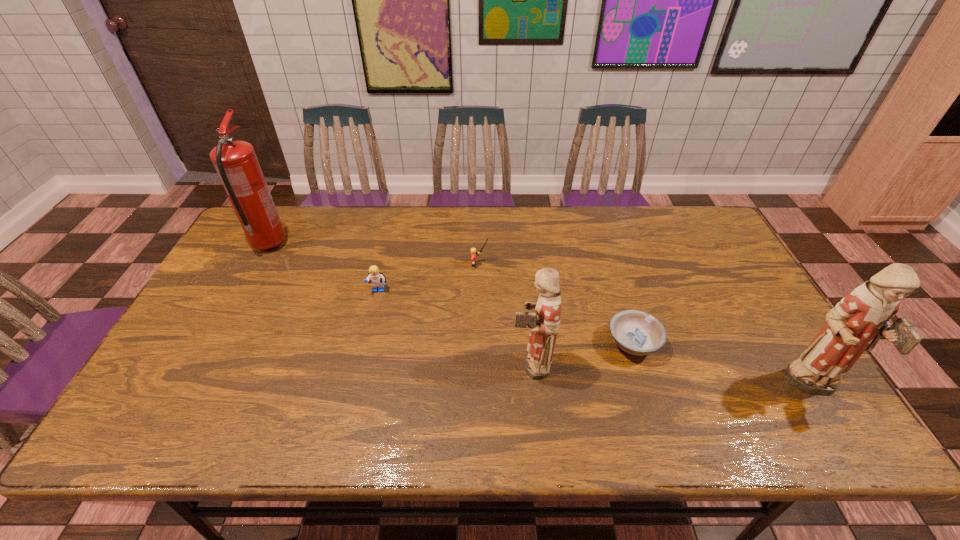
Identify the location of bowl. (635, 332).

The height and width of the screenshot is (540, 960). I want to click on vacant space located on the front-facing side of the fourth shortest object, so click(406, 363).

Locate an element on the screen. The image size is (960, 540). vacant space located on the front-facing side of the fourth shortest object is located at coordinates tap(398, 363).

Find the location of `free space located on the front-facing side of the fourth shortest object`. free space located on the front-facing side of the fourth shortest object is located at coordinates (387, 363).

Image resolution: width=960 pixels, height=540 pixels. I want to click on free region located 0.190m on the front-facing side of the left Lego, so click(x=365, y=351).

Where is `vacant space located 0.140m on the handle side the fire extinguisher`? The image size is (960, 540). vacant space located 0.140m on the handle side the fire extinguisher is located at coordinates (290, 205).

This screenshot has width=960, height=540. Identify the location of free space located on the handle side the fire extinguisher. (290, 205).

You are a GUI agent. You are given a task and a screenshot of the screen. Output one action in this format:
    pyautogui.click(x=<x>, y=<y>)
    Task: Click on the free point located 0.090m on the handle side the fire extinguisher
    
    Given the screenshot: What is the action you would take?
    pyautogui.click(x=286, y=213)

Locate an element on the screen. The image size is (960, 540). vacant region located on the front-facing side of the farther Lego is located at coordinates (581, 265).

At what (x,y) coordinates should I click in order to perform the action: click on vacant space located on the back of the fifth object from left to right. Please return your answer as a coordinate pair (x, y). The width and height of the screenshot is (960, 540). Looking at the image, I should click on (600, 237).